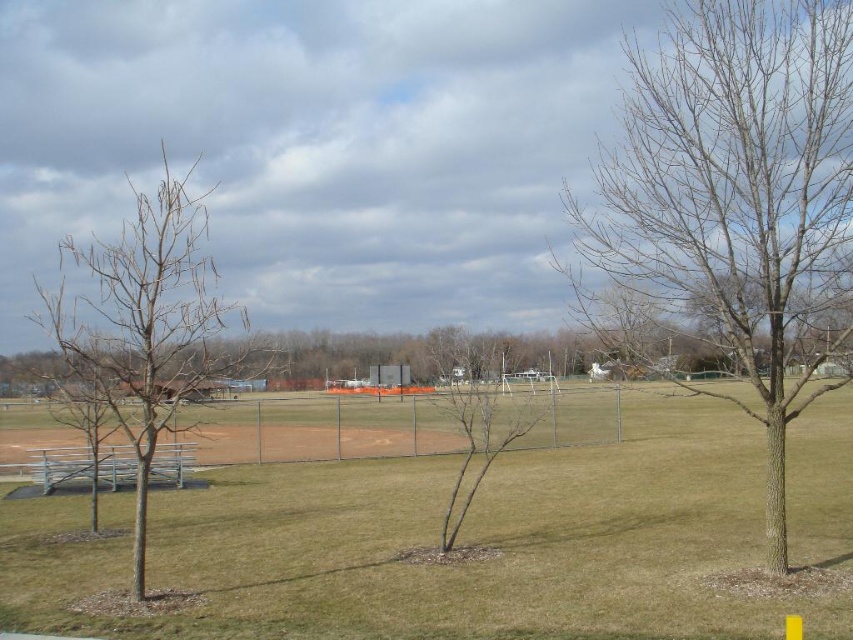
Can you confirm if bare wood tree at right is thinner than bare wood tree at center?

Incorrect, bare wood tree at right's width is not less than bare wood tree at center's.

Which of these two, bare wood tree at right or bare wood tree at center, stands shorter?

bare wood tree at center

Identify the location of bare wood tree at right. (732, 208).

At what (x,y) coordinates should I click in order to perform the action: click on bare wood tree at right. Please return your answer as a coordinate pair (x, y). The image size is (853, 640). Looking at the image, I should click on (732, 208).

Can you confirm if bare wood tree at right is bigger than bare wood tree at left?

Actually, bare wood tree at right might be smaller than bare wood tree at left.

Who is positioned more to the right, bare wood tree at right or bare wood tree at left?

Positioned to the right is bare wood tree at right.

At what (x,y) coordinates should I click in order to perform the action: click on bare wood tree at right. Please return your answer as a coordinate pair (x, y). Image resolution: width=853 pixels, height=640 pixels. Looking at the image, I should click on (732, 208).

Where is `bare wood tree at right`? The width and height of the screenshot is (853, 640). bare wood tree at right is located at coordinates (732, 208).

Between green grass at center and bare wood tree at left, which one appears on the right side from the viewer's perspective?

green grass at center

Is green grass at center closer to the viewer compared to bare wood tree at left?

Yes, green grass at center is in front of bare wood tree at left.

You are a GUI agent. You are given a task and a screenshot of the screen. Output one action in this format:
    pyautogui.click(x=<x>, y=<y>)
    Task: Click on the green grass at center
    This screenshot has width=853, height=640.
    Given the screenshot: What is the action you would take?
    pyautogui.click(x=434, y=544)